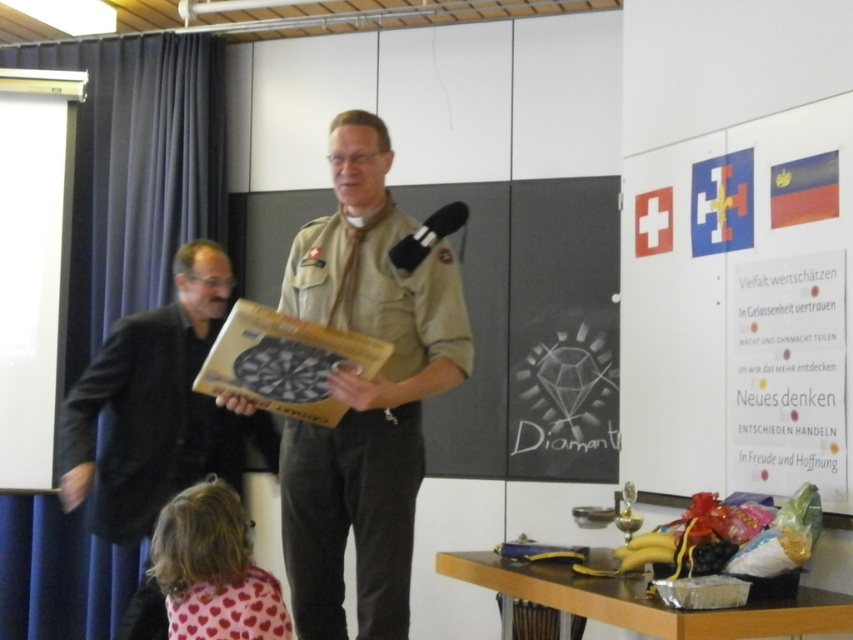
Question: Is matte cardboard dartboard at center closer to the viewer compared to black matte jacket at left?

Choices:
 (A) no
 (B) yes

Answer: (B)

Question: Which object is farther from the camera taking this photo?

Choices:
 (A) pink heart-patterned shirt at lower left
 (B) matte cardboard dartboard at center

Answer: (B)

Question: Which object appears closest to the camera in this image?

Choices:
 (A) pink heart-patterned scarf at lower left
 (B) pink heart-patterned shirt at lower left
 (C) matte cardboard dartboard at center

Answer: (A)

Question: Can you confirm if black matte jacket at left is smaller than pink heart-patterned shirt at lower left?

Choices:
 (A) no
 (B) yes

Answer: (A)

Question: Is matte cardboard dartboard at center above black matte jacket at left?

Choices:
 (A) no
 (B) yes

Answer: (B)

Question: Which object is the farthest from the matte cardboard dartboard at center?

Choices:
 (A) pink heart-patterned shirt at lower left
 (B) black matte jacket at left

Answer: (B)